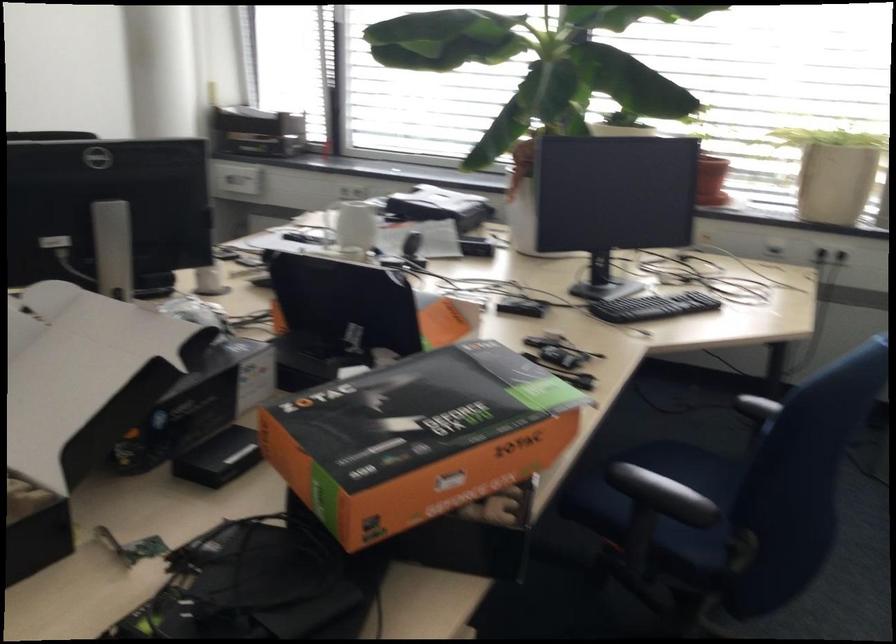
Which object does [399,421] point to?

This point indicates the graphics card box.